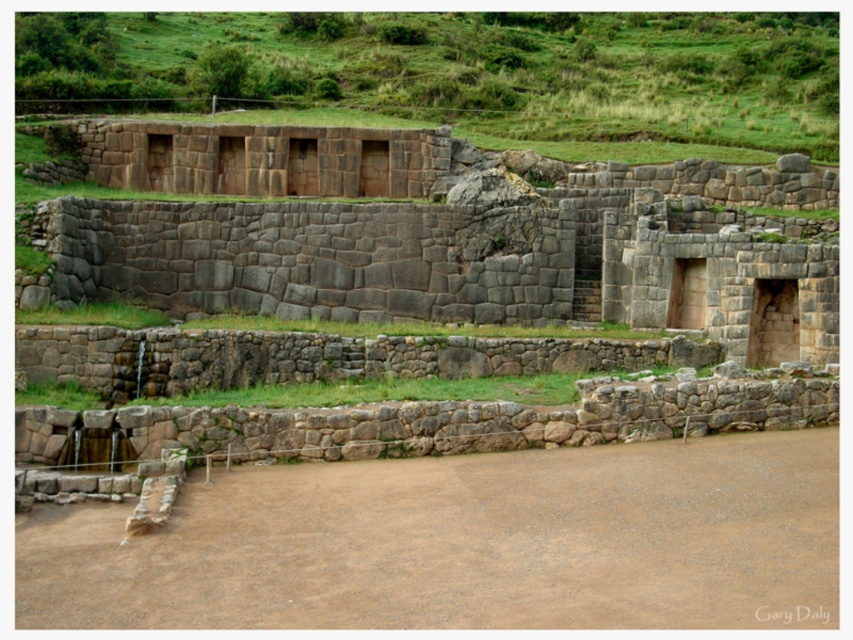
Question: Which object is the closest to the gray stone wall at upper center?

Choices:
 (A) white paper at center
 (B) green grass at upper center

Answer: (B)

Question: From the image, what is the correct spatial relationship of green grass at upper center in relation to white paper at center?

Choices:
 (A) below
 (B) above

Answer: (B)

Question: Where is gray stone wall at upper center located in relation to green grass at upper center in the image?

Choices:
 (A) left
 (B) right

Answer: (A)

Question: Which object is the closest to the gray stone wall at upper center?

Choices:
 (A) white paper at center
 (B) green grass at upper center

Answer: (B)

Question: Which point is farther from the camera taking this photo?

Choices:
 (A) (831, 621)
 (B) (408, 300)

Answer: (B)

Question: From the image, what is the correct spatial relationship of gray stone wall at upper center in relation to green grass at upper center?

Choices:
 (A) below
 (B) above

Answer: (A)